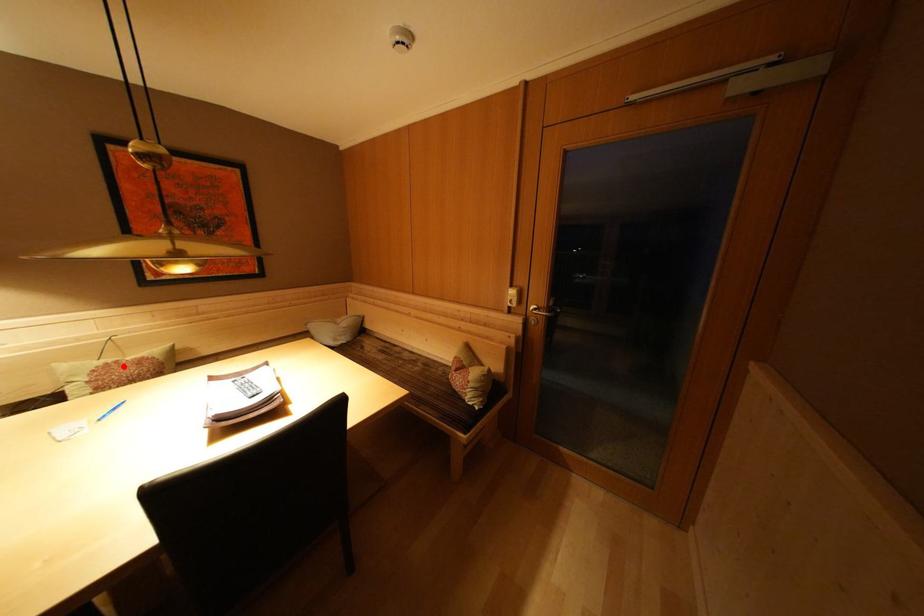
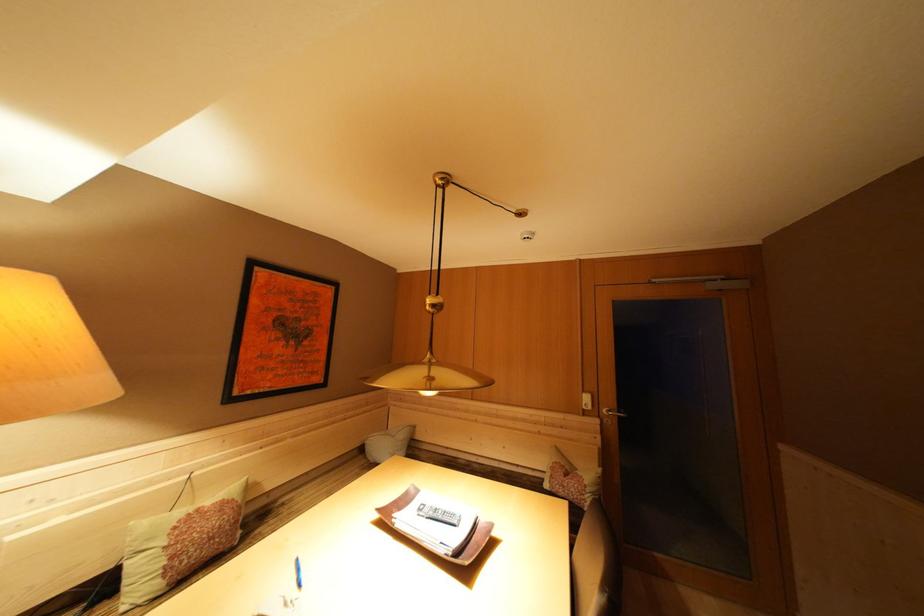
The point at the highlighted location is marked in the first image. Where is the corresponding point in the second image?

(204, 515)